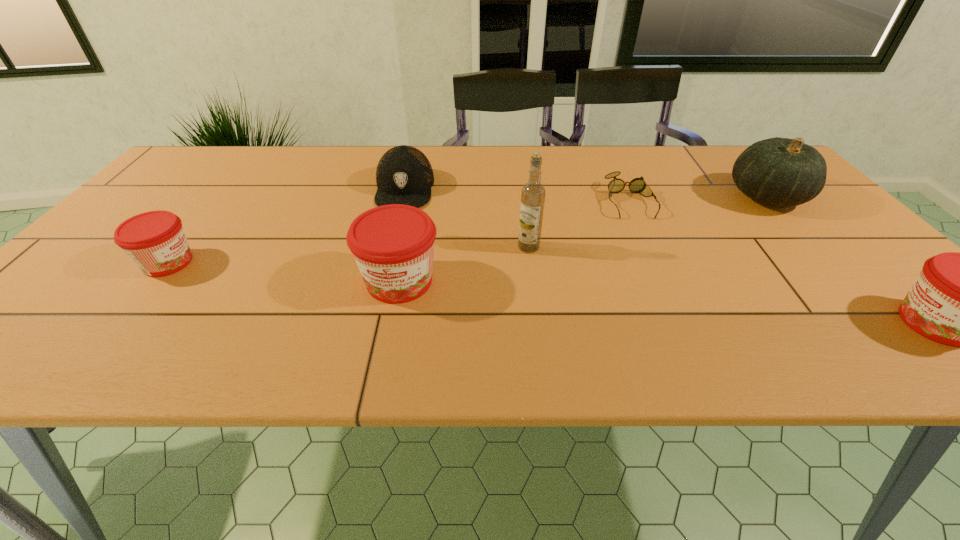
If we want them evenly spaced by inserting an extra jam among them, please locate a free spot for this new jam. Please provide its 2D coordinates. Your answer should be formatted as a tuple, i.e. [(x, y)], where the tuple contains the x and y coordinates of a point satisfying the conditions above.

[(654, 301)]